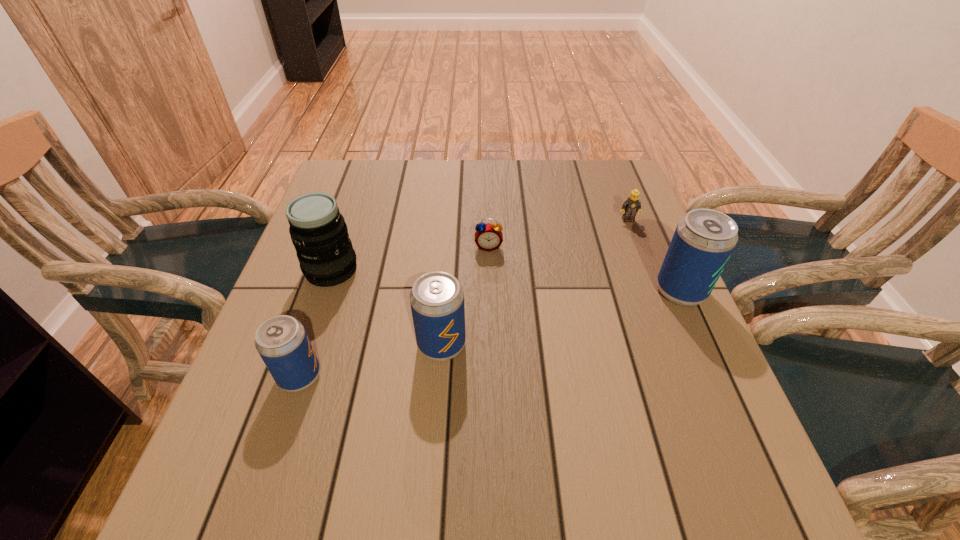
This screenshot has height=540, width=960. I want to click on vacant region located 0.080m on the left of the fourth object from right to left, so click(378, 345).

The height and width of the screenshot is (540, 960). I want to click on blank area located on the back of the rightmost beer can, so click(640, 199).

This screenshot has width=960, height=540. Identify the location of vacant space located in front of the Lego. [664, 315].

Locate an element on the screen. This screenshot has width=960, height=540. free space located 0.200m on the front-facing side of the alarm clock is located at coordinates (490, 314).

Where is `vacant area located 0.060m on the right of the telephoto lens`? The height and width of the screenshot is (540, 960). vacant area located 0.060m on the right of the telephoto lens is located at coordinates (384, 271).

Where is `beer can present at the left edge`? The width and height of the screenshot is (960, 540). beer can present at the left edge is located at coordinates (282, 342).

I want to click on telephoto lens that is at the left edge, so click(319, 233).

Image resolution: width=960 pixels, height=540 pixels. Find the location of `beer can located at the right edge`. beer can located at the right edge is located at coordinates (704, 239).

Locate an element on the screen. This screenshot has width=960, height=540. Lego that is at the right edge is located at coordinates (632, 205).

This screenshot has width=960, height=540. Find the location of `free region at the far edge of the desktop`. free region at the far edge of the desktop is located at coordinates (571, 184).